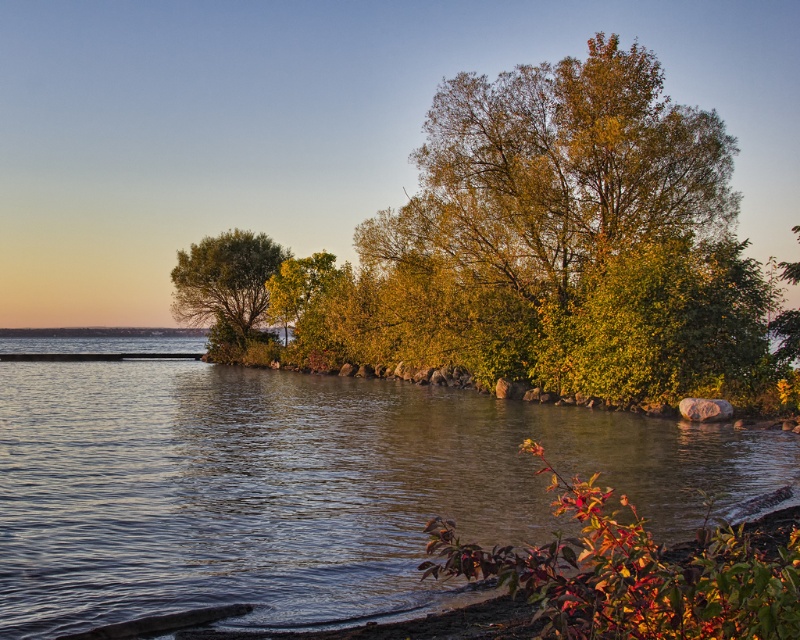
You are standing at the exact center of the image. You want to walk directly towards the clear water at center. In which direction should you move?

Since the clear water at center is located at point (304, 486) in 2D coordinates, which is to the right and slightly above the center, you should move towards the right and slightly upwards to reach it.